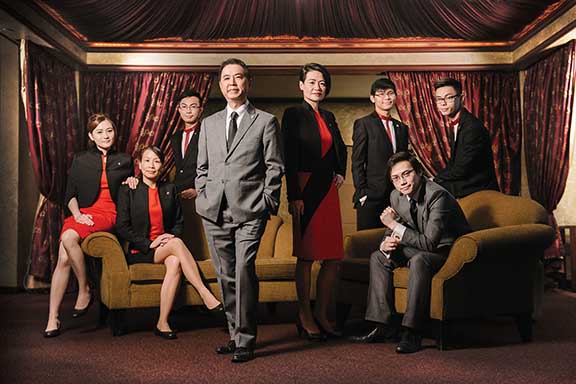
This screenshot has width=576, height=384. Identify the location of walls. (15, 202), (10, 75), (568, 39), (567, 211), (343, 82), (350, 115), (344, 212).